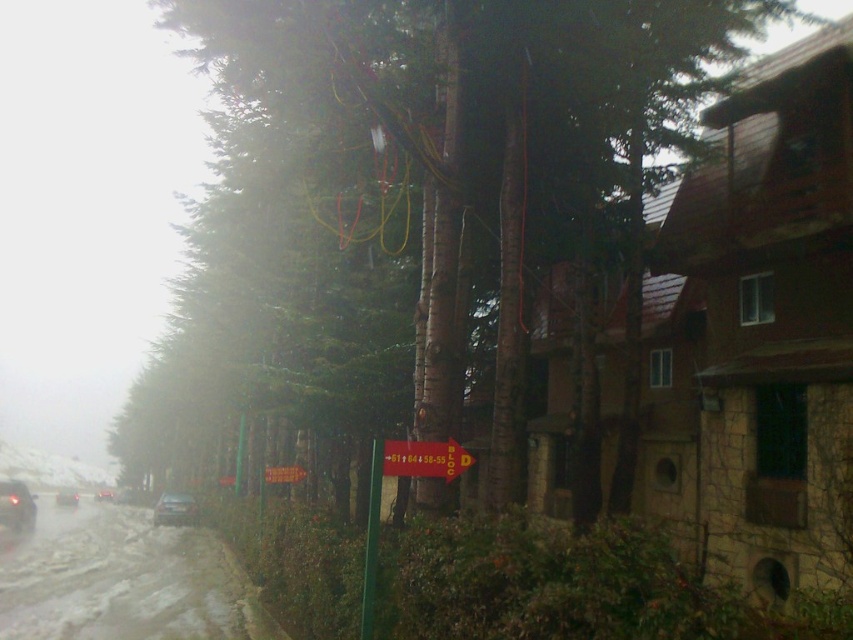
Between brown textured tree at center and shiny silver car at lower left, which one has less height?

Standing shorter between the two is shiny silver car at lower left.

Who is lower down, brown textured tree at center or shiny silver car at lower left?

shiny silver car at lower left is below.

The width and height of the screenshot is (853, 640). Find the location of `brown textured tree at center`. brown textured tree at center is located at coordinates (276, 252).

The image size is (853, 640). What do you see at coordinates (424, 458) in the screenshot?
I see `yellow matte sign at center` at bounding box center [424, 458].

The image size is (853, 640). In order to click on yellow matte sign at center in this screenshot , I will do `click(424, 458)`.

Where is `yellow matte sign at center`? yellow matte sign at center is located at coordinates (424, 458).

Where is `yellow matte sign at center`? yellow matte sign at center is located at coordinates (424, 458).

Who is positioned more to the right, yellow matte sign at center or shiny silver car at lower left?

From the viewer's perspective, yellow matte sign at center appears more on the right side.

Is yellow matte sign at center thinner than shiny silver car at lower left?

Indeed, yellow matte sign at center has a lesser width compared to shiny silver car at lower left.

Who is more distant from viewer, (427, 468) or (161, 522)?

The point (161, 522) is more distant.

Where is `yellow matte sign at center`? The width and height of the screenshot is (853, 640). yellow matte sign at center is located at coordinates (424, 458).